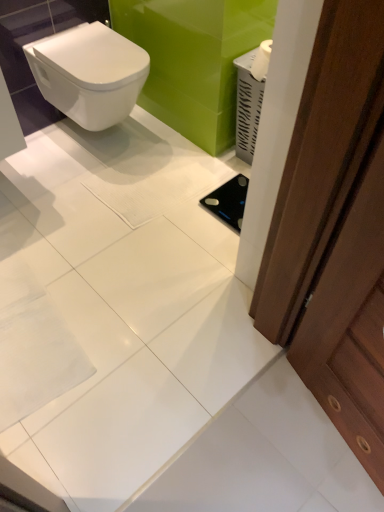
Question: In terms of size, does white glossy toilet at upper left appear bigger or smaller than brown wooden door at right?

Choices:
 (A) small
 (B) big

Answer: (B)

Question: In terms of height, does white glossy toilet at upper left look taller or shorter compared to brown wooden door at right?

Choices:
 (A) tall
 (B) short

Answer: (B)

Question: In terms of width, does white glossy toilet at upper left look wider or thinner when compared to brown wooden door at right?

Choices:
 (A) thin
 (B) wide

Answer: (B)

Question: Considering their positions, is brown wooden door at right located in front of or behind white glossy toilet at upper left?

Choices:
 (A) front
 (B) behind

Answer: (A)

Question: Does point (302, 256) appear closer or farther from the camera than point (105, 91)?

Choices:
 (A) closer
 (B) farther

Answer: (A)

Question: In terms of width, does brown wooden door at right look wider or thinner when compared to white glossy toilet at upper left?

Choices:
 (A) wide
 (B) thin

Answer: (B)

Question: From the image's perspective, is brown wooden door at right located above or below white glossy toilet at upper left?

Choices:
 (A) below
 (B) above

Answer: (A)